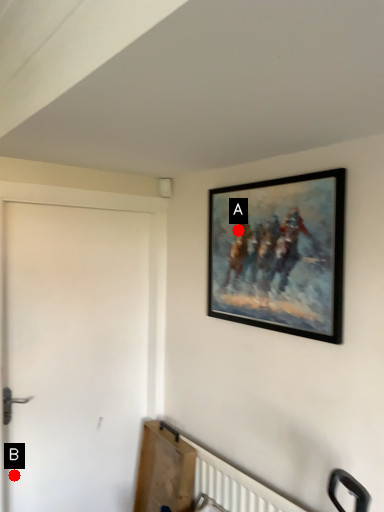
Question: Two points are circled on the image, labeled by A and B beside each circle. Which point is closer to the camera?

Choices:
 (A) A is closer
 (B) B is closer

Answer: (A)